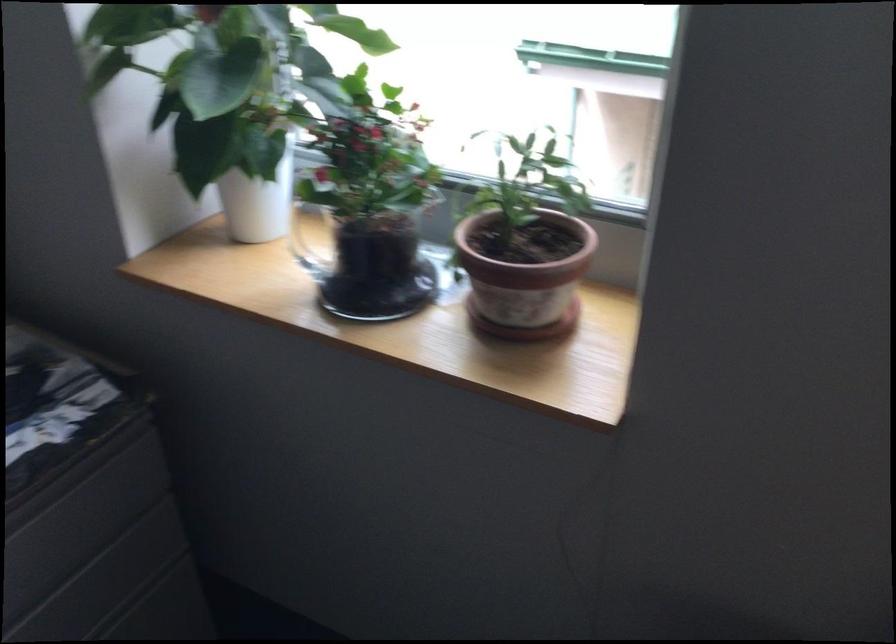
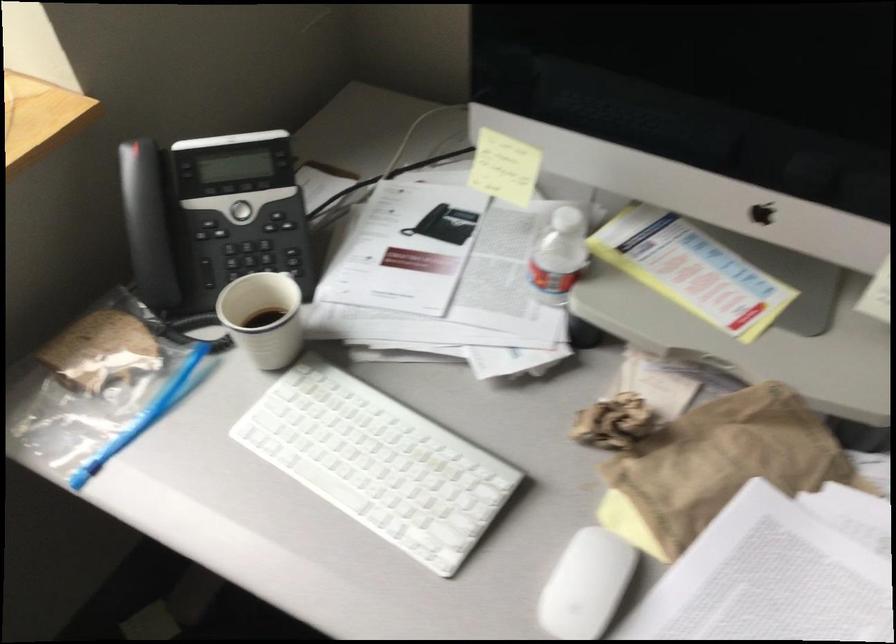
The first image is from the beginning of the video and the second image is from the end. How did the camera likely rotate when shooting the video?

The camera's rotation is toward right-down.